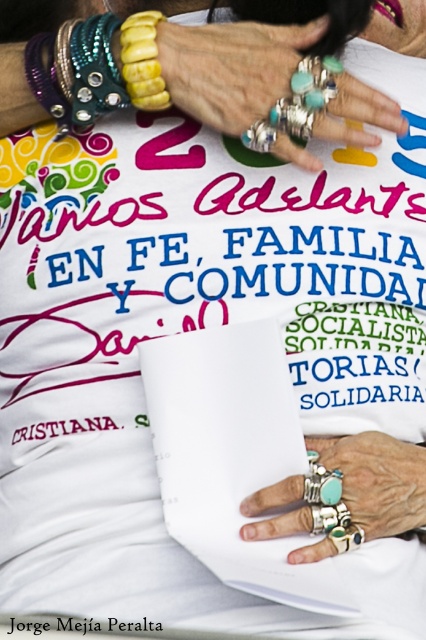
Question: Can you confirm if turquoise stone rings at center is positioned to the right of turquoise silver rings at center?

Choices:
 (A) yes
 (B) no

Answer: (B)

Question: Which point appears farthest from the camera in this image?

Choices:
 (A) (293, 36)
 (B) (416, 499)

Answer: (A)

Question: Which object is closer to the camera taking this photo?

Choices:
 (A) turquoise silver rings at center
 (B) turquoise stone rings at center

Answer: (A)

Question: Among these objects, which one is farthest from the camera?

Choices:
 (A) turquoise stone rings at center
 (B) turquoise silver rings at center

Answer: (A)

Question: Does turquoise stone rings at center lie behind turquoise silver rings at center?

Choices:
 (A) no
 (B) yes

Answer: (B)

Question: Can you confirm if turquoise stone rings at center is smaller than turquoise silver rings at center?

Choices:
 (A) no
 (B) yes

Answer: (A)